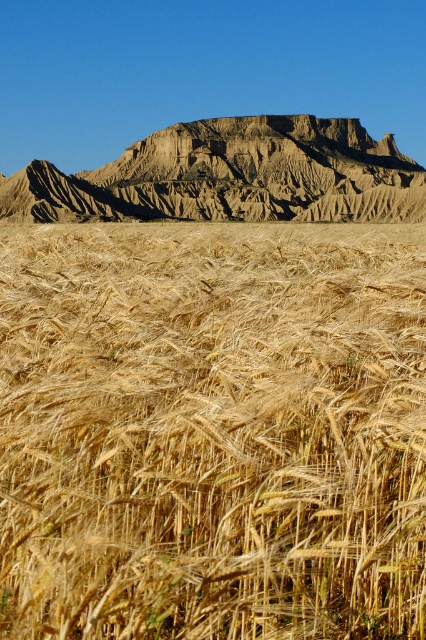
You are standing in the golden wheat field at center and want to reach the rugged brown rock formation at upper center. Which direction should you walk to get there?

You should walk to the right to reach the rugged brown rock formation at upper center because the golden wheat field at center is to the left of it.

Based on the photo, you are a farmer standing in the golden wheat field at center. You look up and see the rugged brown rock formation at upper center. Which object is taller?

The rugged brown rock formation at upper center is taller than the golden wheat field at center.

You are standing in the field and want to take a photo of the golden wheat field at center. Where should you point your camera?

You should point your camera at point (212, 429) to capture the golden wheat field at center.